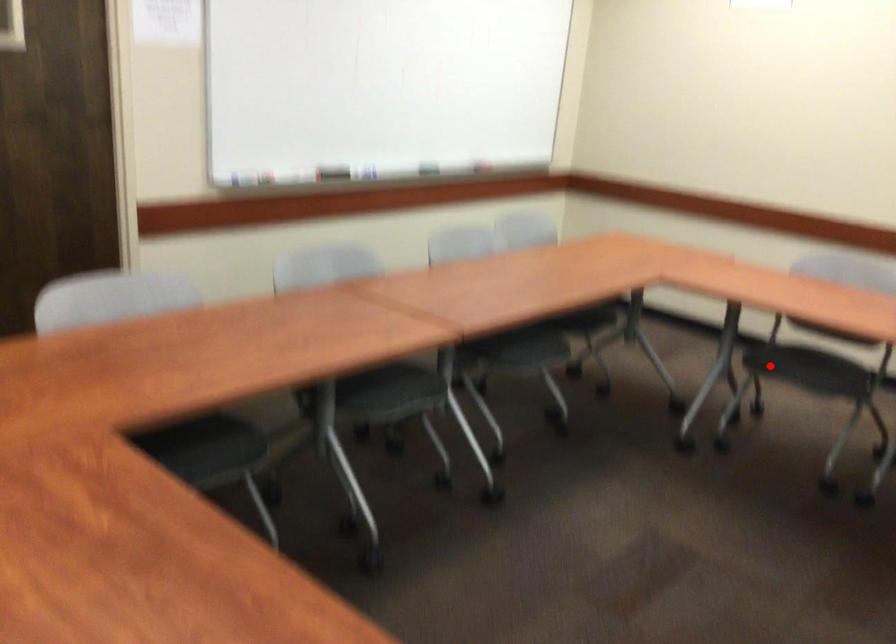
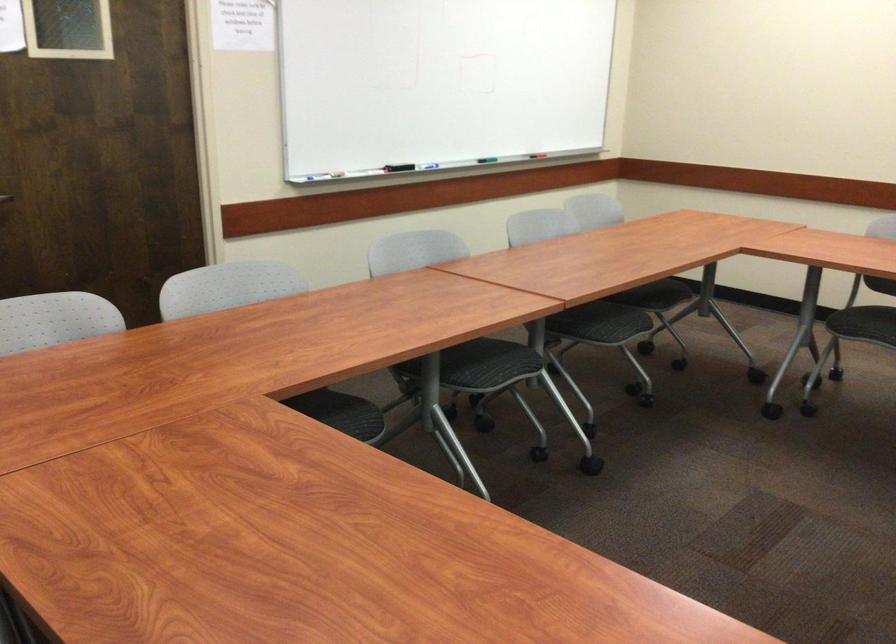
Where in the second image is the point corresponding to the highlighted location from the first image?

(857, 319)